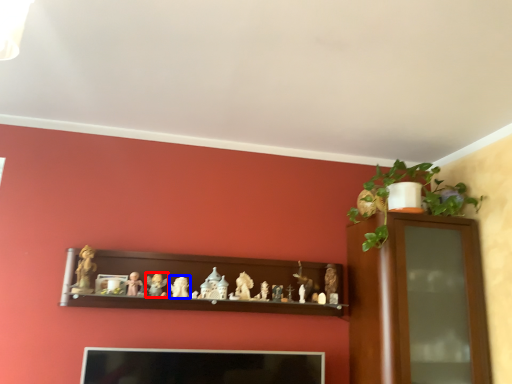
Question: Which object is further to the camera taking this photo, toy (highlighted by a red box) or toy (highlighted by a blue box)?

Choices:
 (A) toy
 (B) toy

Answer: (B)